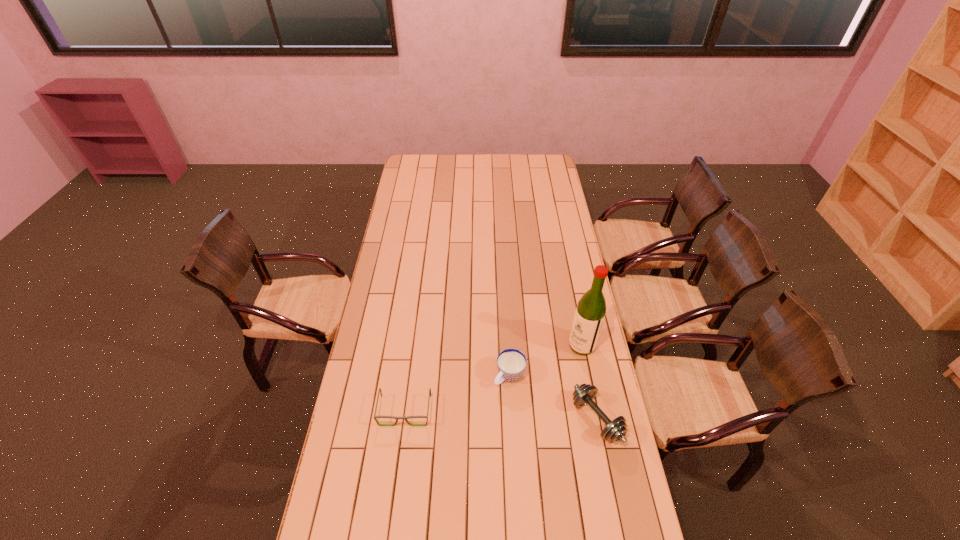
This screenshot has height=540, width=960. I want to click on empty space between the third tallest object and the shortest object, so click(x=457, y=393).

This screenshot has width=960, height=540. In order to click on free space between the second shortest object and the shortest object in this screenshot , I will do `click(457, 393)`.

Point out which object is positioned as the third nearest to the third nearest object. Please provide its 2D coordinates. Your answer should be formatted as a tuple, i.e. [(x, y)], where the tuple contains the x and y coordinates of a point satisfying the conditions above.

[(393, 417)]

This screenshot has height=540, width=960. Find the location of `the third closest object to the dumbbell`. the third closest object to the dumbbell is located at coordinates (393, 417).

This screenshot has height=540, width=960. I want to click on vacant space that satisfies the following two spatial constraints: 1. on the back side of the liquor; 2. on the left side of the third nearest object, so click(508, 346).